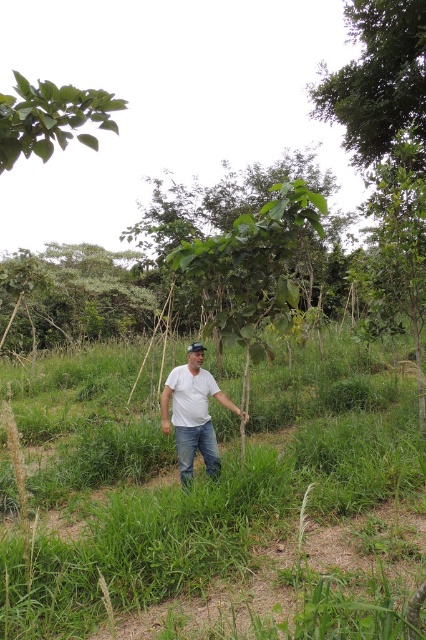
You are a hiker trying to navigate through the forest. You see two trees ahead of you, the green leafy tree at center and the green leafy tree at upper left. Which tree should you choose to avoid getting lost, and why?

You should choose the green leafy tree at center because it has a larger size compared to the green leafy tree at upper left, making it easier to spot from a distance and use as a landmark.